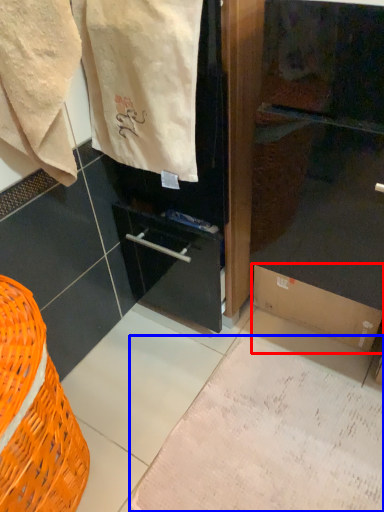
Question: Which object appears closest to the camera in this image, cardboard box (highlighted by a red box) or parchment (highlighted by a blue box)?

Choices:
 (A) cardboard box
 (B) parchment

Answer: (B)